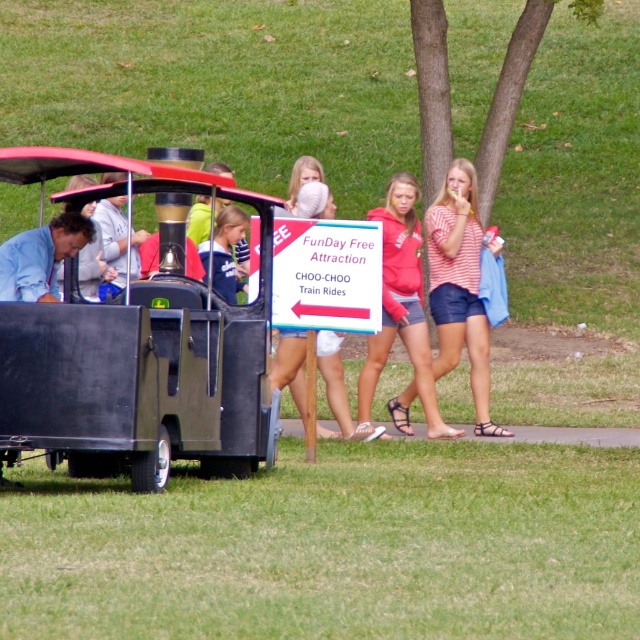
Is point (324, 225) less distant than point (424, 330)?

That is True.

Is point (348, 225) more distant than point (417, 260)?

No.

Locate an element on the screen. The width and height of the screenshot is (640, 640). white paper sign at center is located at coordinates (326, 275).

From the picture: Is striped cotton shirt at center positioned before white paper sign at center?

No, it is behind white paper sign at center.

Is striped cotton shirt at center below white paper sign at center?

Yes.

Where is `striped cotton shirt at center`? striped cotton shirt at center is located at coordinates (460, 285).

Who is higher up, matte black wagon at left or matte red hoodie at center?

matte red hoodie at center

Does matte black wagon at left appear on the right side of matte red hoodie at center?

Incorrect, matte black wagon at left is not on the right side of matte red hoodie at center.

What do you see at coordinates (138, 342) in the screenshot?
I see `matte black wagon at left` at bounding box center [138, 342].

You are a GUI agent. You are given a task and a screenshot of the screen. Output one action in this format:
    pyautogui.click(x=<x>, y=<y>)
    Task: Click on the matte black wagon at left
    This screenshot has height=640, width=640.
    Given the screenshot: What is the action you would take?
    pyautogui.click(x=138, y=342)